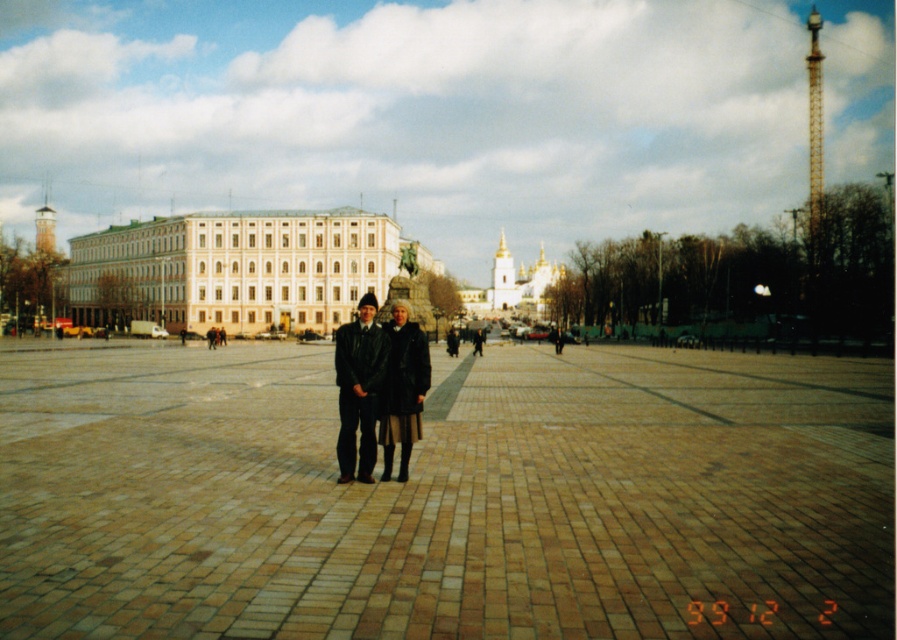
You are standing in the plaza and see two items at the center. Which one is taller between the leather jacket at center and the dark brown leather coat at center?

The leather jacket at center is taller than the dark brown leather coat at center according to the description.

You are standing in the plaza and see the white smooth building at center and the leather jacket at center. Which object is positioned to the left from your perspective?

The white smooth building at center is to the left of the leather jacket at center.

You are a fashion designer observing two items in the plaza. You see the leather jacket at center and the dark brown leather coat at center. Which item has a greater width?

The leather jacket at center has a greater width than the dark brown leather coat at center as stated in the description.